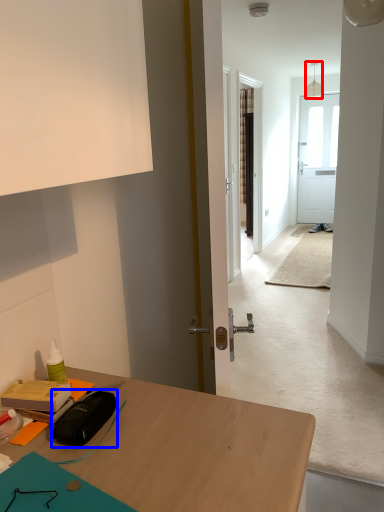
Question: Which object appears farthest to the camera in this image, lamp (highlighted by a red box) or stationery (highlighted by a blue box)?

Choices:
 (A) lamp
 (B) stationery

Answer: (A)